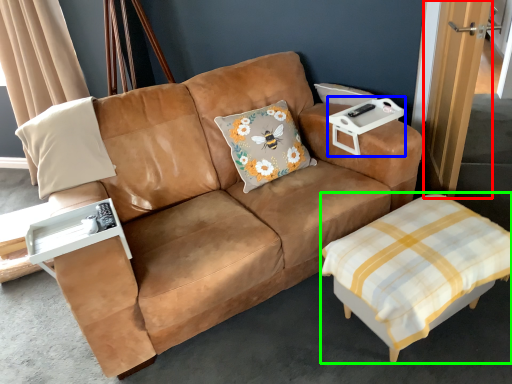
Question: Which object is positioned closest to door (highlighted by a red box)? Select from cocktail table (highlighted by a blue box) and table (highlighted by a green box).

Choices:
 (A) cocktail table
 (B) table

Answer: (A)